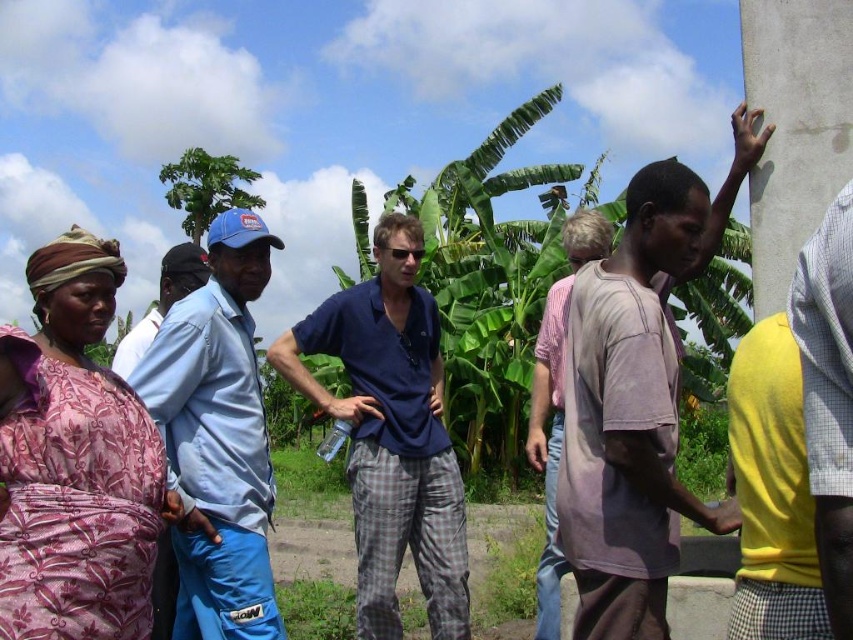
Question: Does blue cotton shirt at center come in front of blue fabric shirt at center?

Choices:
 (A) yes
 (B) no

Answer: (B)

Question: Which point is closer to the camera?

Choices:
 (A) green leafy banana tree at center
 (B) gray concrete pillar at right
 (C) purple floral fabric dress at left

Answer: (C)

Question: Which point appears closest to the camera in this image?

Choices:
 (A) (253, 584)
 (B) (695, 257)
 (C) (70, 593)

Answer: (C)

Question: Is blue cotton shirt at center smaller than light blue shirt at left?

Choices:
 (A) yes
 (B) no

Answer: (B)

Question: Among these objects, which one is nearest to the camera?

Choices:
 (A) green leafy banana tree at center
 (B) blue cotton shirt at center
 (C) light brown cotton shirt at center

Answer: (A)

Question: Can you confirm if gray concrete pillar at right is bigger than light blue fabric at left?

Choices:
 (A) yes
 (B) no

Answer: (B)